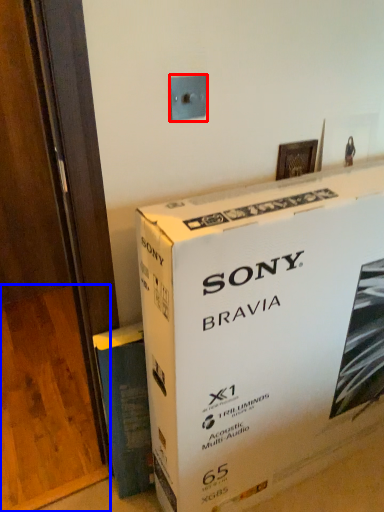
Question: Which object is closer to the camera taking this photo, electric outlet (highlighted by a red box) or plywood (highlighted by a blue box)?

Choices:
 (A) electric outlet
 (B) plywood

Answer: (A)